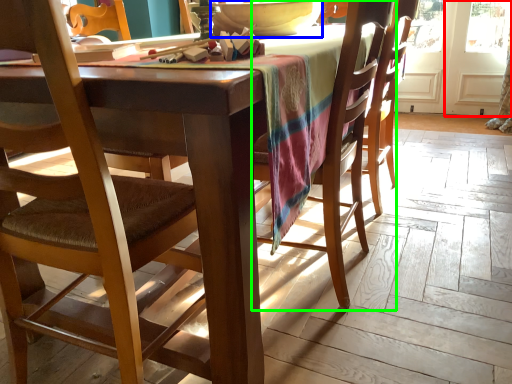
Question: Estimate the real-world distances between objects in this image. Which object is farther from screen door (highlighted by a red box), bowl (highlighted by a blue box) or chair (highlighted by a green box)?

Choices:
 (A) bowl
 (B) chair

Answer: (A)